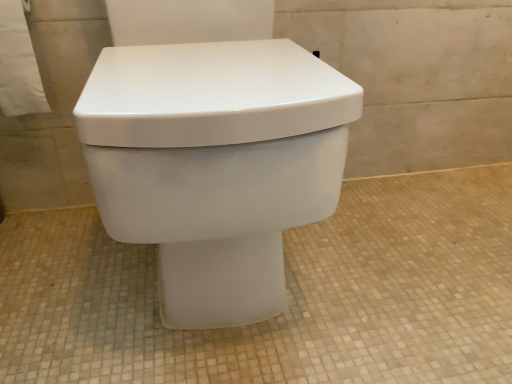
Locate an element on the screen. This screenshot has height=384, width=512. vacant space to the right of white glossy toilet at center is located at coordinates (401, 254).